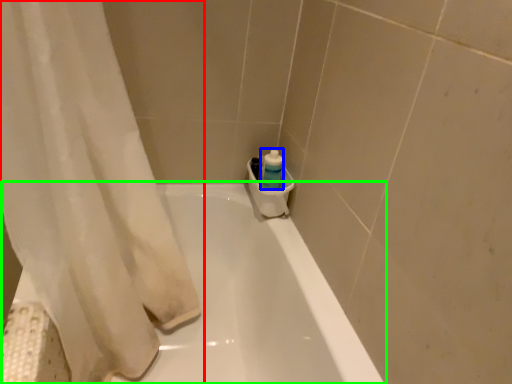
Question: Considering the real-world distances, which object is closest to curtain (highlighted by a red box)? cleaning product (highlighted by a blue box) or bathtub (highlighted by a green box).

Choices:
 (A) cleaning product
 (B) bathtub

Answer: (B)